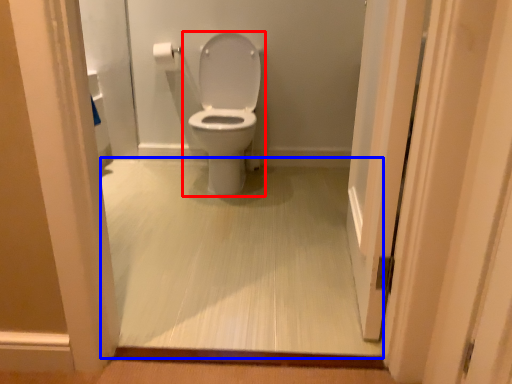
Question: Among these objects, which one is farthest to the camera, toilet (highlighted by a red box) or corridor (highlighted by a blue box)?

Choices:
 (A) toilet
 (B) corridor

Answer: (A)